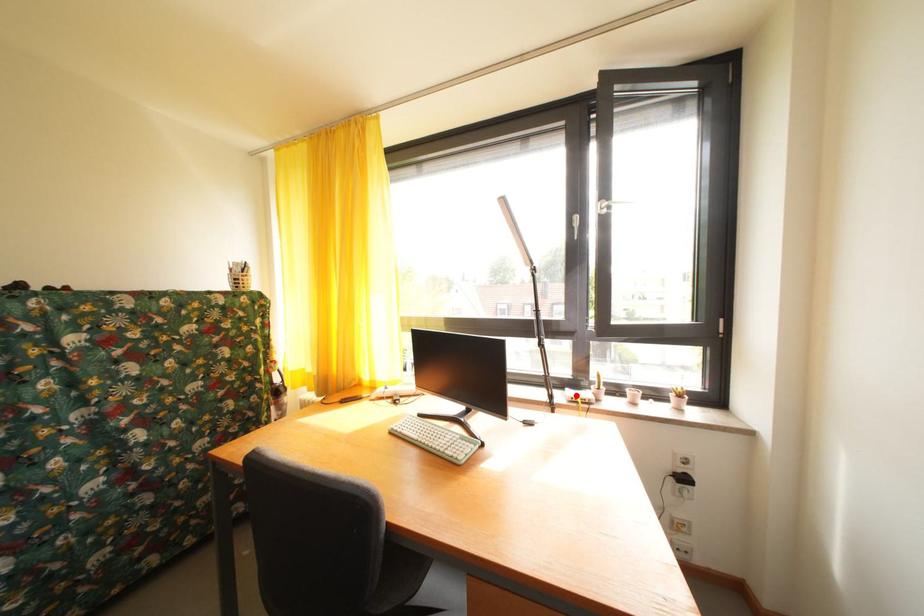
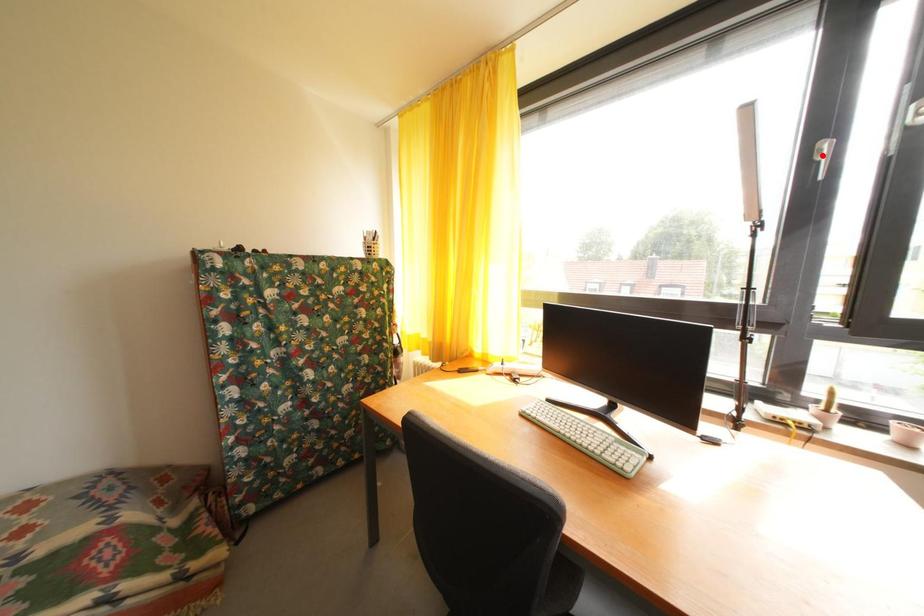
From the picture: I am providing you with two images of the same scene from different viewpoints. A red point is marked on the first image and another point is marked on the second image. Are the points marked in image1 and image2 representing the same 3D position?

No